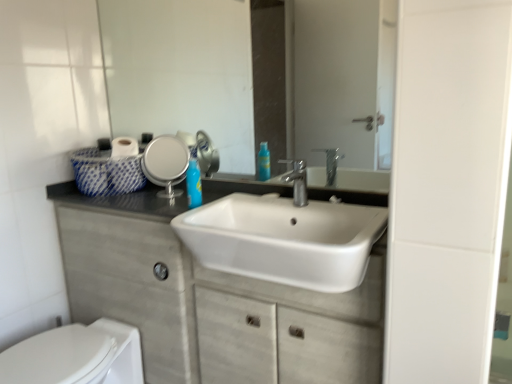
Question: Does white glossy toilet at lower left contain clear glass mirror at upper center?

Choices:
 (A) no
 (B) yes

Answer: (A)

Question: From a real-world perspective, does white glossy toilet at lower left sit lower than clear glass mirror at upper center?

Choices:
 (A) no
 (B) yes

Answer: (B)

Question: Does white glossy toilet at lower left have a lesser height compared to clear glass mirror at upper center?

Choices:
 (A) yes
 (B) no

Answer: (A)

Question: Is clear glass mirror at upper center at the back of white glossy toilet at lower left?

Choices:
 (A) no
 (B) yes

Answer: (A)

Question: Are white glossy toilet at lower left and clear glass mirror at upper center located far from each other?

Choices:
 (A) yes
 (B) no

Answer: (A)

Question: Is clear glass mirror at upper center inside or outside of white glossy sink at center?

Choices:
 (A) outside
 (B) inside

Answer: (A)

Question: From the image's perspective, is clear glass mirror at upper center positioned above or below white glossy sink at center?

Choices:
 (A) below
 (B) above

Answer: (B)

Question: Is clear glass mirror at upper center in front of or behind white glossy sink at center in the image?

Choices:
 (A) behind
 (B) front

Answer: (A)

Question: Visually, is clear glass mirror at upper center positioned to the left or to the right of white glossy sink at center?

Choices:
 (A) right
 (B) left

Answer: (B)

Question: From the image's perspective, is white glossy sink at center positioned above or below silver metallic faucet at center?

Choices:
 (A) below
 (B) above

Answer: (A)

Question: From a real-world perspective, is white glossy sink at center above or below silver metallic faucet at center?

Choices:
 (A) above
 (B) below

Answer: (B)

Question: Relative to silver metallic faucet at center, is white glossy sink at center in front or behind?

Choices:
 (A) front
 (B) behind

Answer: (A)

Question: Considering the positions of point tap(296, 178) and point tap(305, 200), is point tap(296, 178) closer or farther from the camera than point tap(305, 200)?

Choices:
 (A) farther
 (B) closer

Answer: (A)

Question: From a real-world perspective, is white glossy sink at center positioned above or below white glossy toilet at lower left?

Choices:
 (A) above
 (B) below

Answer: (A)

Question: Is white glossy sink at center inside the boundaries of white glossy toilet at lower left, or outside?

Choices:
 (A) inside
 (B) outside

Answer: (B)